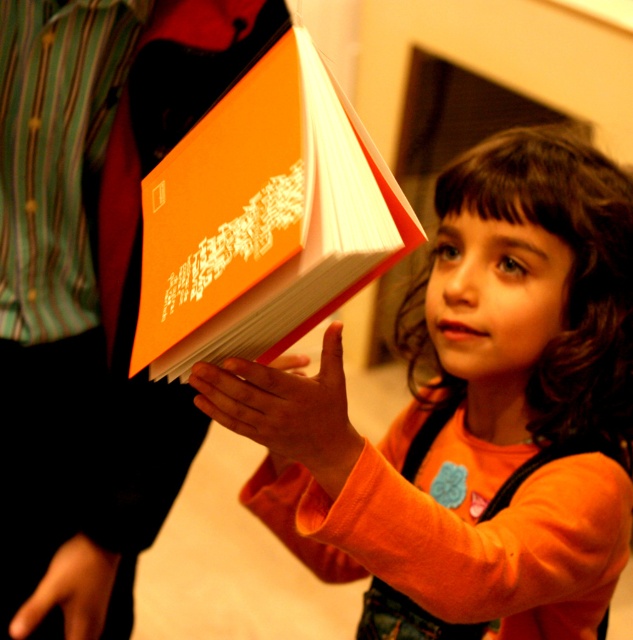
Question: Which point appears farthest from the camera in this image?

Choices:
 (A) (592, 492)
 (B) (339, 109)

Answer: (A)

Question: Is matte orange book at center closer to camera compared to orange matte book at center?

Choices:
 (A) no
 (B) yes

Answer: (A)

Question: Can you confirm if matte orange book at center is positioned to the left of orange matte book at center?

Choices:
 (A) yes
 (B) no

Answer: (B)

Question: Is matte orange book at center bigger than orange matte book at center?

Choices:
 (A) yes
 (B) no

Answer: (A)